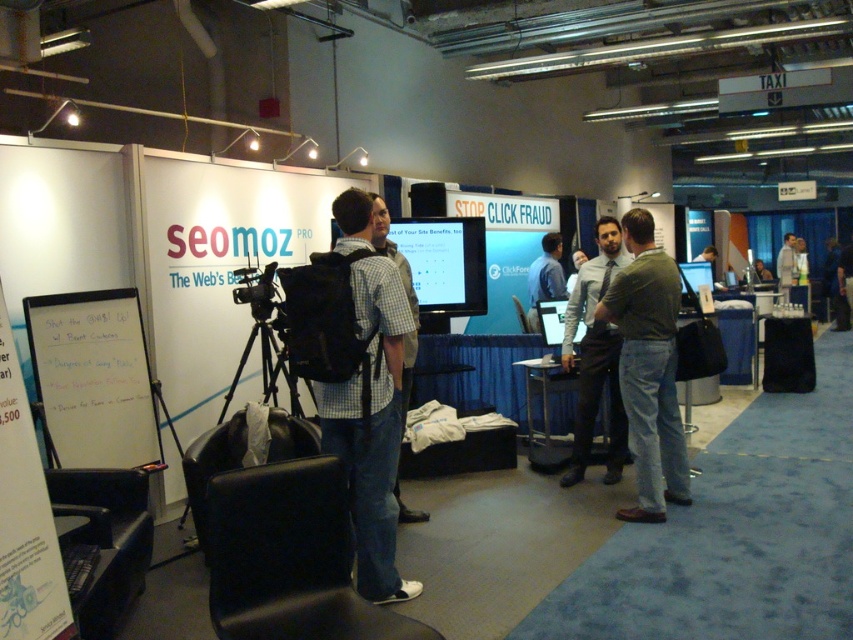
Is black matte video camera at center thinner than silver metallic laptop at center?

Incorrect, black matte video camera at center's width is not less than silver metallic laptop at center's.

Does black matte video camera at center appear on the right side of silver metallic laptop at center?

Incorrect, black matte video camera at center is not on the right side of silver metallic laptop at center.

Between point (258, 316) and point (583, 333), which one is positioned in front?

Point (258, 316) is more forward.

Image resolution: width=853 pixels, height=640 pixels. I want to click on black matte video camera at center, so click(256, 289).

Between plaid fabric shirt at center and black matte video camera at center, which one has less height?

Standing shorter between the two is black matte video camera at center.

Does plaid fabric shirt at center come in front of black matte video camera at center?

Yes, plaid fabric shirt at center is closer to the viewer.

This screenshot has height=640, width=853. I want to click on plaid fabric shirt at center, so click(405, 292).

Image resolution: width=853 pixels, height=640 pixels. Find the location of `plaid fabric shirt at center`. plaid fabric shirt at center is located at coordinates (405, 292).

Is whiteboard at left closer to the viewer compared to green cotton shirt at center?

That is True.

Can you confirm if whiteboard at left is positioned to the left of green cotton shirt at center?

Indeed, whiteboard at left is positioned on the left side of green cotton shirt at center.

Identify the location of whiteboard at left. (93, 378).